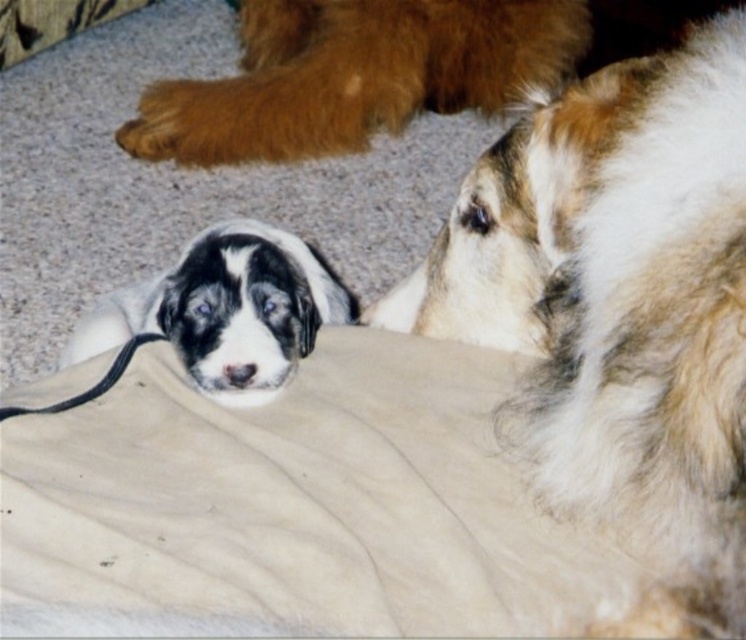
You are a photographer setting up a shoot in this scene. You want to position a small stool between the beige fabric at center and the fluffy white dog at upper right. Based on their positions, where should you place the stool?

The beige fabric at center is to the left of the fluffy white dog at upper right, so you should place the stool between them on the left side of the dog and the right side of the fabric.